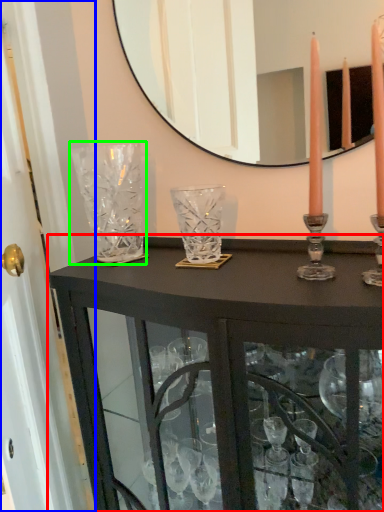
Question: Estimate the real-world distances between objects in this image. Which object is farther from table (highlighted by a red box), glass door (highlighted by a blue box) or glass vase (highlighted by a green box)?

Choices:
 (A) glass door
 (B) glass vase

Answer: (A)